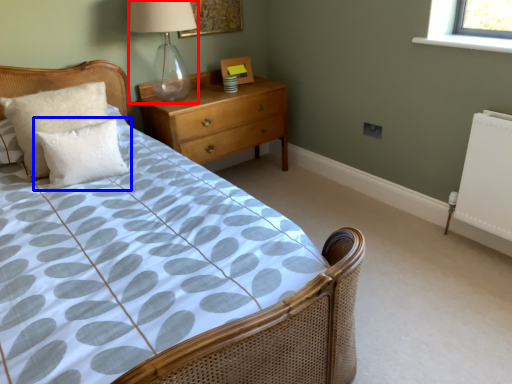
Question: Which object is closer to the camera taking this photo, table lamp (highlighted by a red box) or pillow (highlighted by a blue box)?

Choices:
 (A) table lamp
 (B) pillow

Answer: (B)